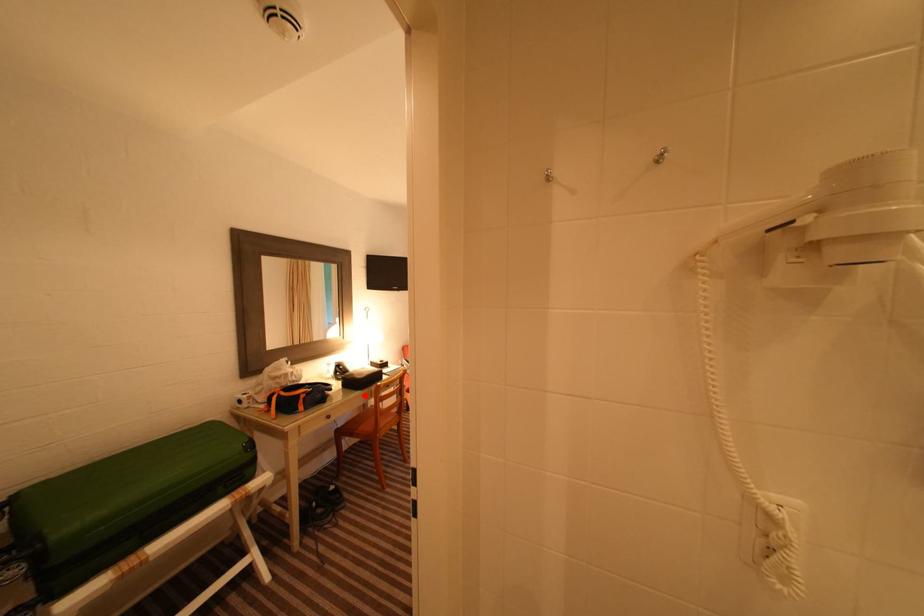
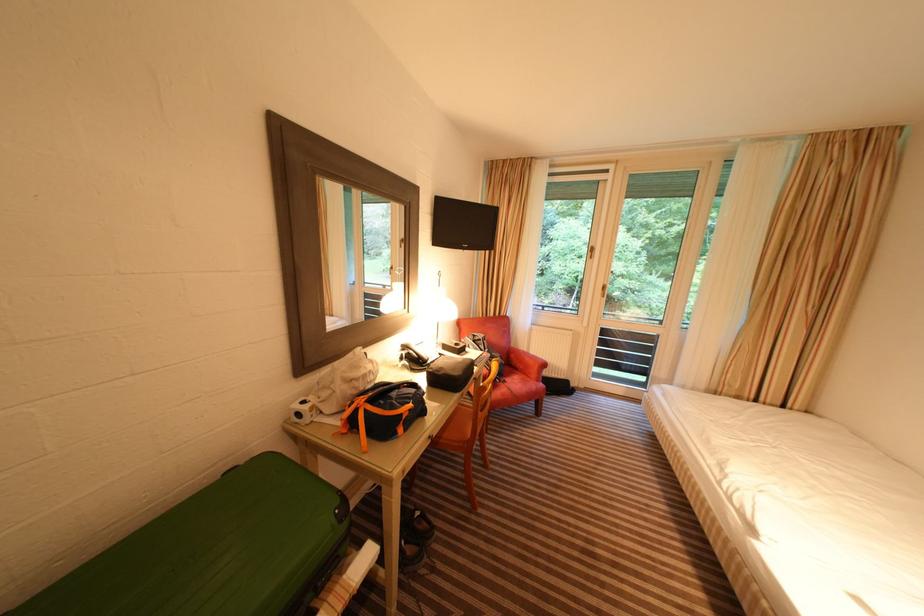
In the second image, find the point that corresponds to the highlighted location in the first image.

(463, 399)